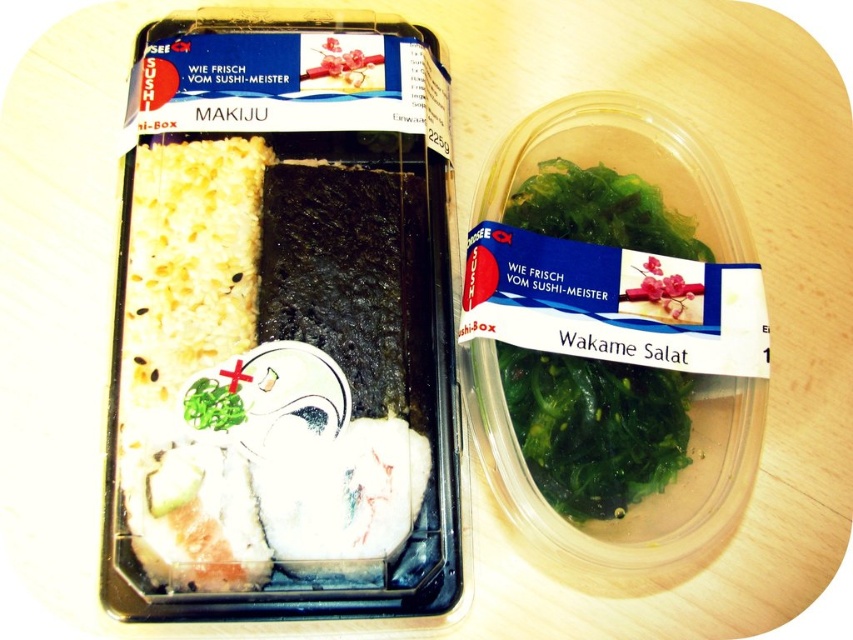
Question: Does white rice at left come in front of green leafy seaweed at center?

Choices:
 (A) no
 (B) yes

Answer: (B)

Question: Which of the following is the closest to the observer?

Choices:
 (A) green leafy seaweed at center
 (B) white rice at left
 (C) green leafy wakame salat at right

Answer: (B)

Question: Is white rice at left to the right of green leafy wakame salat at right from the viewer's perspective?

Choices:
 (A) yes
 (B) no

Answer: (B)

Question: Can you confirm if white rice at left is positioned to the right of green leafy seaweed at center?

Choices:
 (A) no
 (B) yes

Answer: (A)

Question: Which point is farther from the camera taking this photo?

Choices:
 (A) (645, 490)
 (B) (664, 464)

Answer: (B)

Question: Which point is closer to the camera?

Choices:
 (A) white rice at left
 (B) green leafy wakame salat at right

Answer: (A)